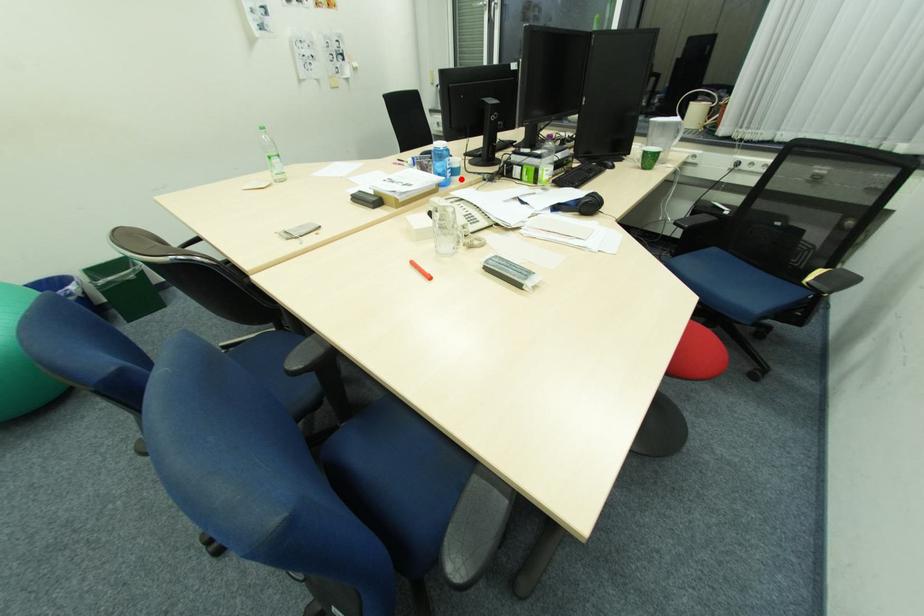
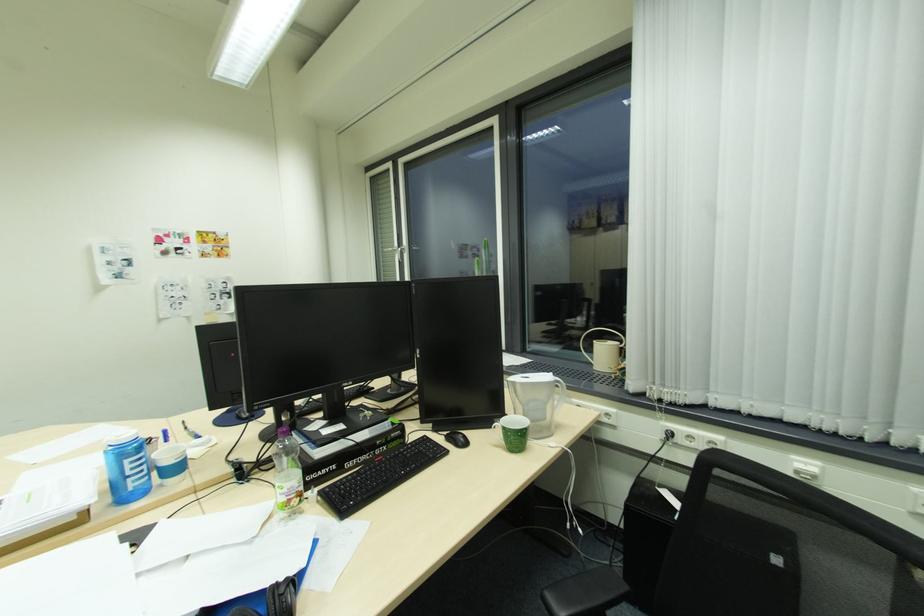
Question: I am providing you with two images of the same scene from different viewpoints. A red point is marked on the first image. Can you still see the location of the red point in image 2?

Choices:
 (A) Yes
 (B) No

Answer: (A)